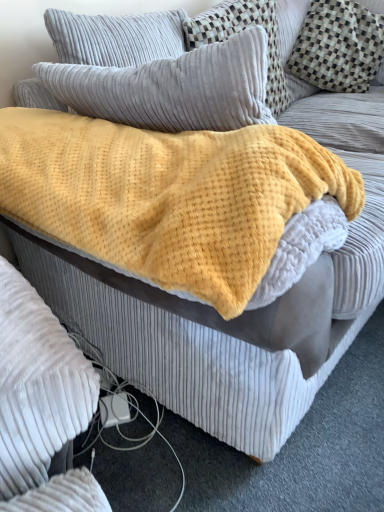
Question: From the image's perspective, does checkered fabric pillow at upper right, the 3th pillow in the left-to-right sequence, appear lower than velvety gray pillow at upper left, which appears as the 1th pillow when viewed from the left?

Choices:
 (A) no
 (B) yes

Answer: (A)

Question: Could you tell me if checkered fabric pillow at upper right, the 3th pillow in the left-to-right sequence, is turned towards velvety gray pillow at upper left, which appears as the 1th pillow when viewed from the left?

Choices:
 (A) no
 (B) yes

Answer: (B)

Question: From a real-world perspective, is checkered fabric pillow at upper right, the first pillow from the right, positioned over velvety gray pillow at upper left, the 3th pillow viewed from the right, based on gravity?

Choices:
 (A) no
 (B) yes

Answer: (A)

Question: Is checkered fabric pillow at upper right, the 3th pillow in the left-to-right sequence, directly adjacent to velvety gray pillow at upper left, the 3th pillow viewed from the right?

Choices:
 (A) yes
 (B) no

Answer: (B)

Question: Does checkered fabric pillow at upper right, the first pillow from the right, appear on the left side of velvety gray pillow at upper left, the 3th pillow viewed from the right?

Choices:
 (A) no
 (B) yes

Answer: (A)

Question: Is velvety gray pillow at upper left, the 3th pillow viewed from the right, inside checkered fabric pillow at upper right, the first pillow from the right?

Choices:
 (A) yes
 (B) no

Answer: (B)

Question: Is checkered fabric pillow at upper right, the first pillow from the right, beside yellow fuzzy blanket at center?

Choices:
 (A) yes
 (B) no

Answer: (B)

Question: From a real-world perspective, is checkered fabric pillow at upper right, the first pillow from the right, below yellow fuzzy blanket at center?

Choices:
 (A) no
 (B) yes

Answer: (B)

Question: Is checkered fabric pillow at upper right, the 3th pillow in the left-to-right sequence, positioned far away from yellow fuzzy blanket at center?

Choices:
 (A) yes
 (B) no

Answer: (A)

Question: Is checkered fabric pillow at upper right, the 3th pillow in the left-to-right sequence, not inside yellow fuzzy blanket at center?

Choices:
 (A) no
 (B) yes

Answer: (B)

Question: Considering the relative sizes of checkered fabric pillow at upper right, the 3th pillow in the left-to-right sequence, and yellow fuzzy blanket at center in the image provided, is checkered fabric pillow at upper right, the 3th pillow in the left-to-right sequence, wider than yellow fuzzy blanket at center?

Choices:
 (A) no
 (B) yes

Answer: (A)

Question: Does checkered fabric pillow at upper right, the first pillow from the right, appear on the left side of yellow fuzzy blanket at center?

Choices:
 (A) yes
 (B) no

Answer: (B)

Question: Does yellow fuzzy blanket at center have a greater height compared to checkered fabric pillow at upper right, the 3th pillow in the left-to-right sequence?

Choices:
 (A) no
 (B) yes

Answer: (A)